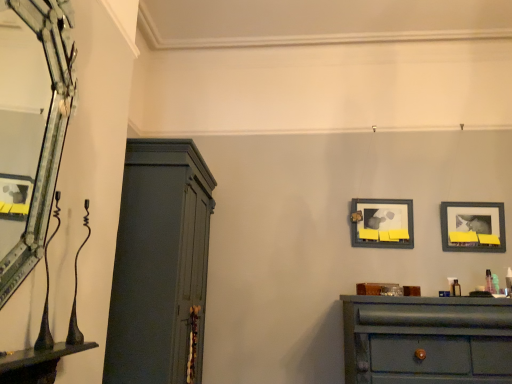
Question: Is wooden framed picture at center, which ranks as the first picture frame in left-to-right order, smaller than matte gray cupboard at left?

Choices:
 (A) no
 (B) yes

Answer: (B)

Question: Is wooden framed picture at center, the second picture frame positioned from the right, facing towards matte gray cupboard at left?

Choices:
 (A) yes
 (B) no

Answer: (B)

Question: Would you say wooden framed picture at center, the second picture frame positioned from the right, contains matte gray cupboard at left?

Choices:
 (A) no
 (B) yes

Answer: (A)

Question: Is wooden framed picture at center, which ranks as the first picture frame in left-to-right order, positioned beyond the bounds of matte gray cupboard at left?

Choices:
 (A) yes
 (B) no

Answer: (A)

Question: Considering the relative sizes of wooden framed picture at center, the second picture frame positioned from the right, and matte gray cupboard at left in the image provided, is wooden framed picture at center, the second picture frame positioned from the right, taller than matte gray cupboard at left?

Choices:
 (A) no
 (B) yes

Answer: (A)

Question: Is wooden framed picture at center, the second picture frame positioned from the right, taller or shorter than matte green dresser at lower right?

Choices:
 (A) tall
 (B) short

Answer: (B)

Question: Choose the correct answer: Is wooden framed picture at center, which ranks as the first picture frame in left-to-right order, inside matte green dresser at lower right or outside it?

Choices:
 (A) outside
 (B) inside

Answer: (A)

Question: Visually, is wooden framed picture at center, which ranks as the first picture frame in left-to-right order, positioned to the left or to the right of matte green dresser at lower right?

Choices:
 (A) left
 (B) right

Answer: (A)

Question: From the image's perspective, is wooden framed picture at center, the second picture frame positioned from the right, located above or below matte green dresser at lower right?

Choices:
 (A) above
 (B) below

Answer: (A)

Question: Looking at their shapes, would you say matte green dresser at lower right is wider or thinner than matte gray cupboard at left?

Choices:
 (A) thin
 (B) wide

Answer: (A)

Question: Based on their positions, is matte green dresser at lower right located to the left or right of matte gray cupboard at left?

Choices:
 (A) right
 (B) left

Answer: (A)

Question: Considering the positions of point (489, 382) and point (179, 213), is point (489, 382) closer or farther from the camera than point (179, 213)?

Choices:
 (A) closer
 (B) farther

Answer: (B)

Question: From the image's perspective, is matte green dresser at lower right above or below matte gray cupboard at left?

Choices:
 (A) above
 (B) below

Answer: (B)

Question: Which is correct: wooden framed picture at center, which ranks as the first picture frame in left-to-right order, is inside matte black picture frame at upper right, which ranks as the first picture frame in right-to-left order, or outside of it?

Choices:
 (A) outside
 (B) inside

Answer: (A)

Question: In the image, is wooden framed picture at center, the second picture frame positioned from the right, positioned in front of or behind matte black picture frame at upper right, the 2th picture frame viewed from the left?

Choices:
 (A) behind
 (B) front

Answer: (A)